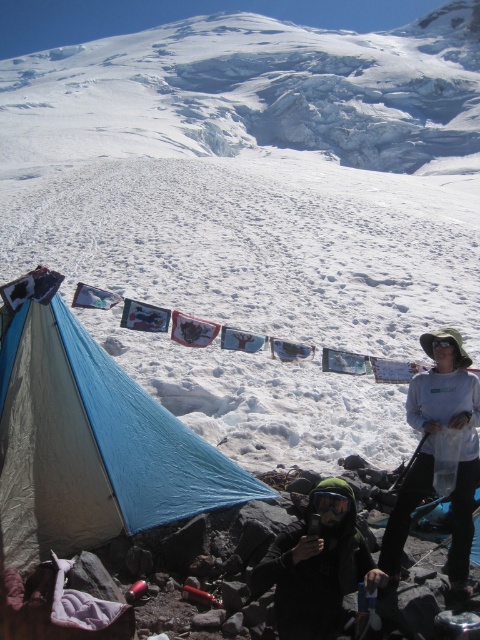
Is blue fabric tent at lower left taller than white cotton shirt at right?

Indeed, blue fabric tent at lower left has a greater height compared to white cotton shirt at right.

Is blue fabric tent at lower left wider than white cotton shirt at right?

Indeed, blue fabric tent at lower left has a greater width compared to white cotton shirt at right.

Measure the distance between point (148, 483) and camera.

12.33 meters

Identify the location of blue fabric tent at lower left. The width and height of the screenshot is (480, 640). (92, 445).

Which of these two, white cotton shirt at right or black matte helmet at lower center, stands shorter?

With less height is white cotton shirt at right.

Is point (460, 460) positioned behind point (317, 508)?

Yes, point (460, 460) is behind point (317, 508).

Locate an element on the screen. This screenshot has height=640, width=480. white cotton shirt at right is located at coordinates (432, 452).

Can you confirm if blue fabric tent at lower left is wider than black matte helmet at lower center?

Correct, the width of blue fabric tent at lower left exceeds that of black matte helmet at lower center.

Can you confirm if blue fabric tent at lower left is smaller than black matte helmet at lower center?

No, blue fabric tent at lower left is not smaller than black matte helmet at lower center.

Identify the location of blue fabric tent at lower left. This screenshot has height=640, width=480. [x=92, y=445].

Find the location of a particular element. blue fabric tent at lower left is located at coordinates (92, 445).